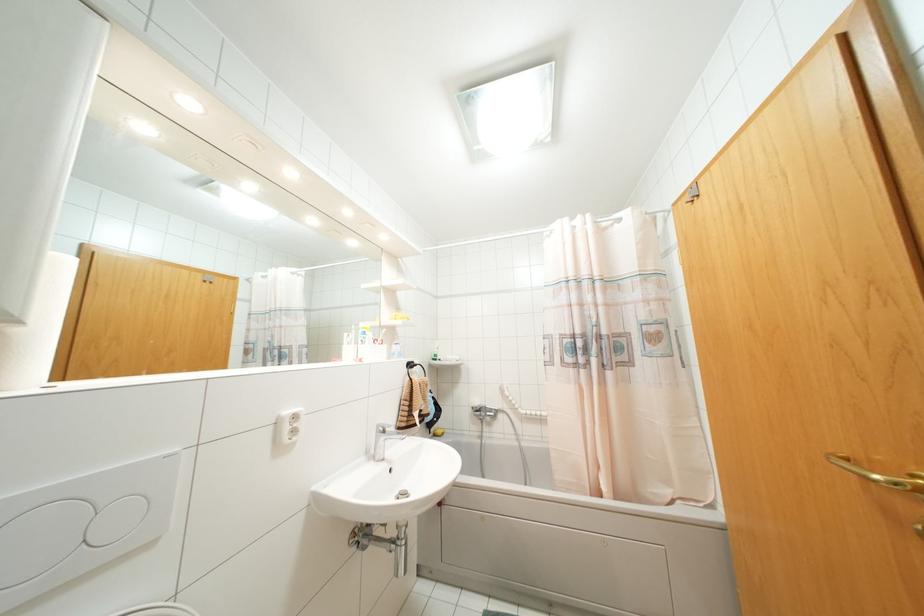
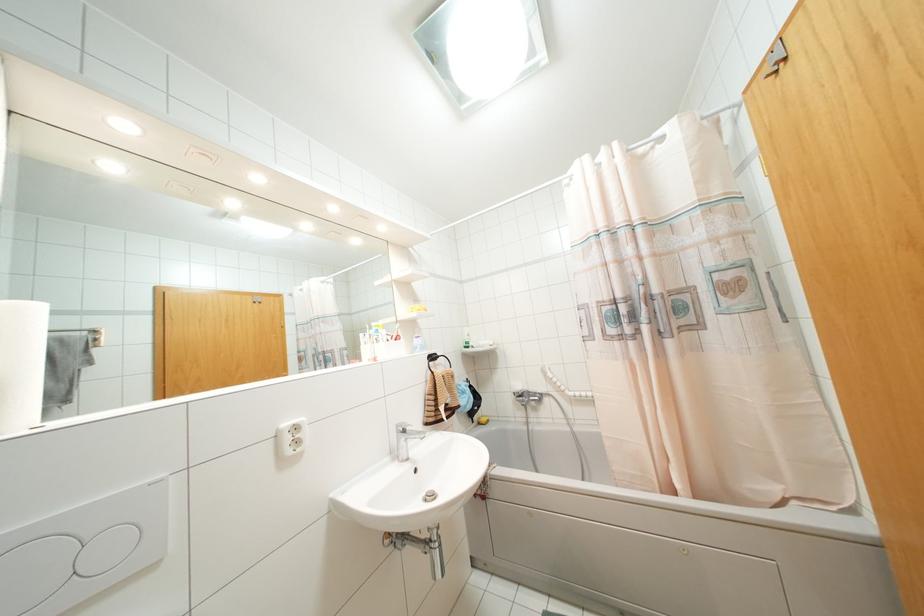
Question: The camera is either moving clockwise (left) or counter-clockwise (right) around the object. The first image is from the beginning of the video and the second image is from the end. Is the camera moving left or right when shooting the video?

Choices:
 (A) Left
 (B) Right

Answer: (B)